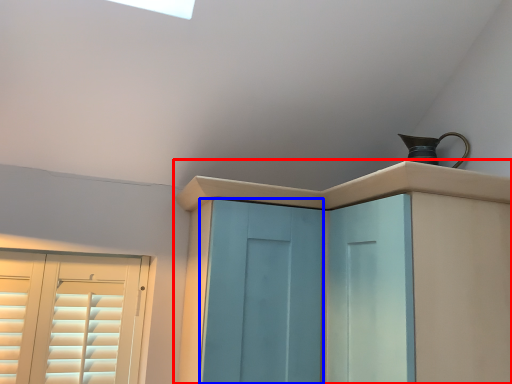
Question: Which point is closer to the camera, cupboard (highlighted by a red box) or screen door (highlighted by a blue box)?

Choices:
 (A) cupboard
 (B) screen door

Answer: (A)